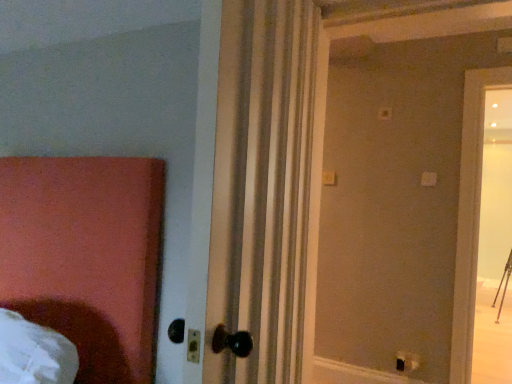
Question: From a real-world perspective, is white striped curtain at center physically located above or below black plastic electric outlet at lower right?

Choices:
 (A) above
 (B) below

Answer: (A)

Question: Choose the correct answer: Is white striped curtain at center inside black plastic electric outlet at lower right or outside it?

Choices:
 (A) inside
 (B) outside

Answer: (B)

Question: Based on their sizes in the image, would you say white striped curtain at center is bigger or smaller than black plastic electric outlet at lower right?

Choices:
 (A) big
 (B) small

Answer: (A)

Question: Considering the relative positions of black plastic electric outlet at lower right and white striped curtain at center in the image provided, is black plastic electric outlet at lower right to the left or to the right of white striped curtain at center?

Choices:
 (A) left
 (B) right

Answer: (B)

Question: Is black plastic electric outlet at lower right inside the boundaries of white striped curtain at center, or outside?

Choices:
 (A) outside
 (B) inside

Answer: (A)

Question: Looking at their shapes, would you say black plastic electric outlet at lower right is wider or thinner than white striped curtain at center?

Choices:
 (A) wide
 (B) thin

Answer: (B)

Question: Is black plastic electric outlet at lower right bigger or smaller than white striped curtain at center?

Choices:
 (A) small
 (B) big

Answer: (A)